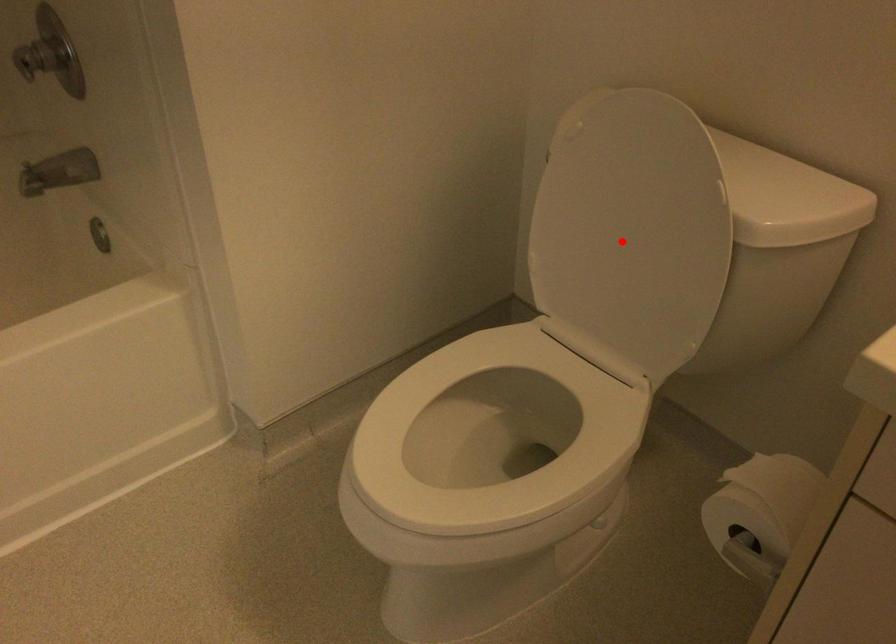
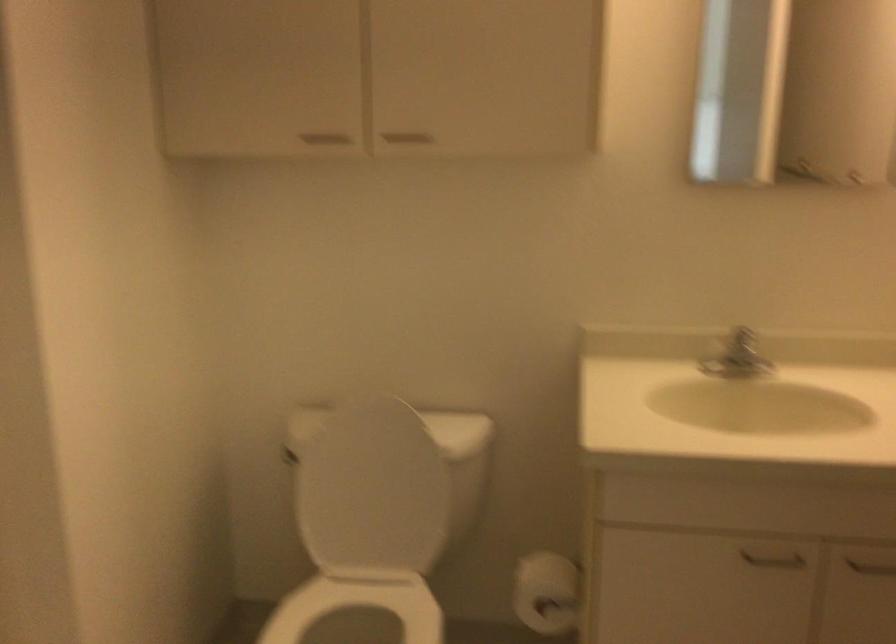
Find the pixel in the second image that matches the highlighted location in the first image.

(373, 491)